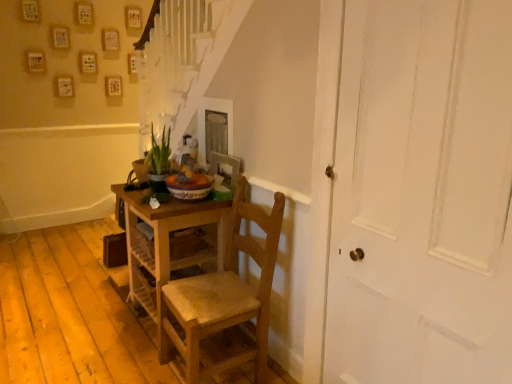
Image resolution: width=512 pixels, height=384 pixels. In order to click on vacant area situated to the left side of wooden desk at center in this screenshot , I will do `click(82, 328)`.